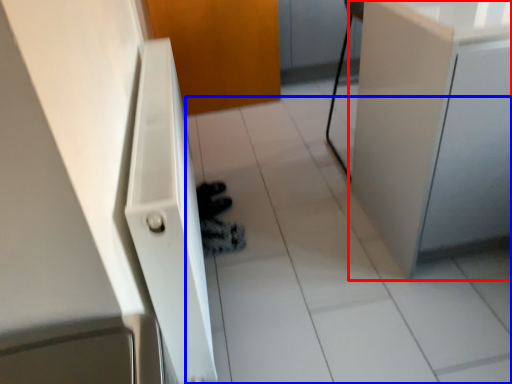
Question: Which object is closer to the camera taking this photo, cabinetry (highlighted by a red box) or tile (highlighted by a blue box)?

Choices:
 (A) cabinetry
 (B) tile

Answer: (A)